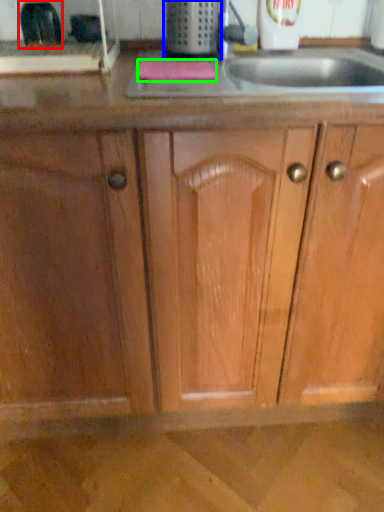
Question: Based on their relative distances, which object is nearer to appliance (highlighted by a red box)? Choose from appliance (highlighted by a blue box) and soap (highlighted by a green box).

Choices:
 (A) appliance
 (B) soap

Answer: (B)